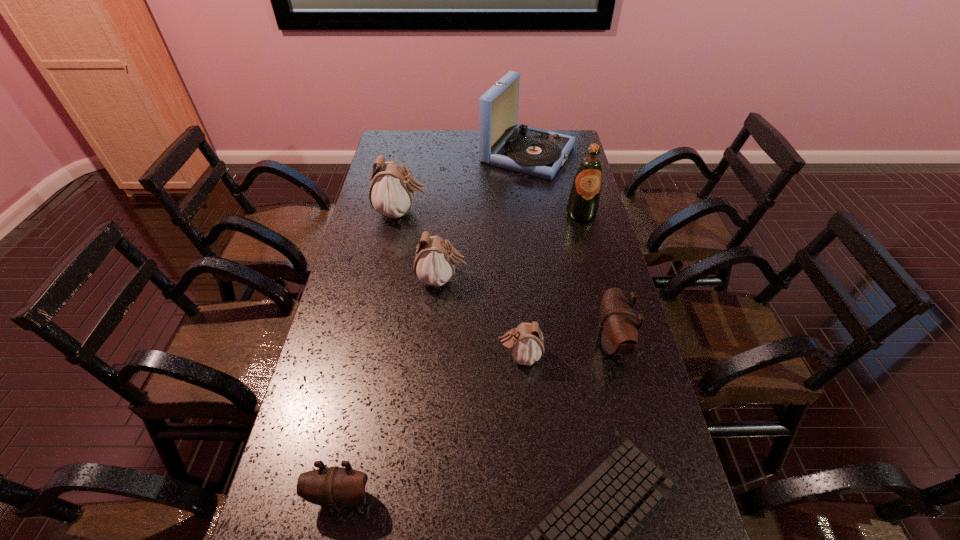
Find the location of a particular element. This screenshot has width=960, height=540. vacant space at the right edge of the desktop is located at coordinates point(610,256).

This screenshot has height=540, width=960. Find the location of `free space at the far left corner`. free space at the far left corner is located at coordinates (396, 132).

At what (x,y) coordinates should I click in order to perform the action: click on empty location between the nearer brown pouch and the olive oil. Please return your answer as a coordinate pair (x, y). The width and height of the screenshot is (960, 540). Looking at the image, I should click on (461, 355).

Find the location of a particular element. The height and width of the screenshot is (540, 960). free area in between the sixth shortest object and the nearest pouch is located at coordinates (372, 355).

At what (x,y) coordinates should I click in order to perform the action: click on vacant area that lies between the biggest white pouch and the left brown pouch. Please return your answer as a coordinate pair (x, y). The height and width of the screenshot is (540, 960). Looking at the image, I should click on (372, 355).

You are a GUI agent. You are given a task and a screenshot of the screen. Output one action in this format:
    pyautogui.click(x=<x>, y=<y>)
    Task: Click on the free point between the green olive oil and the left brown pouch
    
    Given the screenshot: What is the action you would take?
    pos(461,355)

Where is `free spot between the rightmost pouch and the smaller brown pouch`? Image resolution: width=960 pixels, height=540 pixels. free spot between the rightmost pouch and the smaller brown pouch is located at coordinates (476, 420).

Locate an element on the screen. This screenshot has width=960, height=540. free spot between the fifth nearest object and the phonograph record is located at coordinates click(x=485, y=217).

The height and width of the screenshot is (540, 960). I want to click on vacant region between the third tallest object and the bigger brown pouch, so click(x=506, y=277).

The width and height of the screenshot is (960, 540). In order to click on vacant area that lies between the smallest white pouch and the blue phonograph record in this screenshot , I will do `click(524, 255)`.